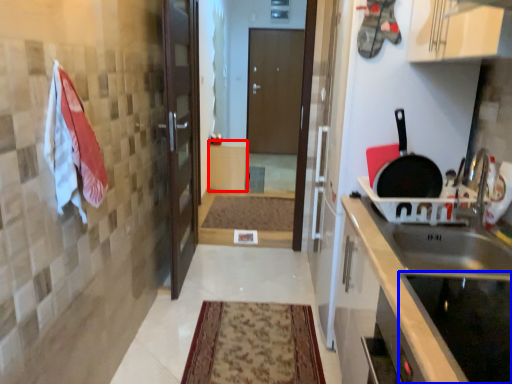
Question: Among these objects, which one is farthest to the camera, cabinetry (highlighted by a red box) or appliance (highlighted by a blue box)?

Choices:
 (A) cabinetry
 (B) appliance

Answer: (A)